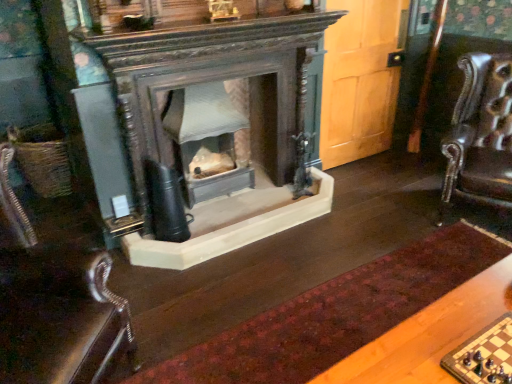
Where is `vacant area on top of velvet burgundy rug at center (from a real-world perspective)`? The width and height of the screenshot is (512, 384). vacant area on top of velvet burgundy rug at center (from a real-world perspective) is located at coordinates (358, 304).